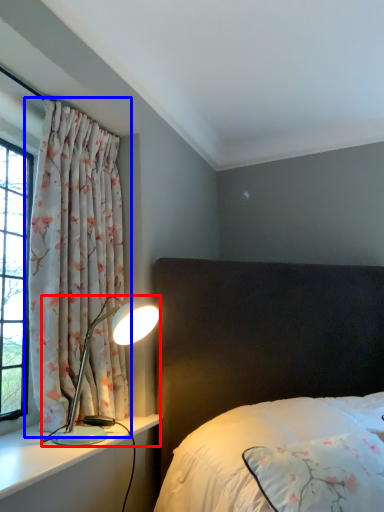
Question: Which object appears farthest to the camera in this image, lamp (highlighted by a red box) or curtain (highlighted by a blue box)?

Choices:
 (A) lamp
 (B) curtain

Answer: (B)